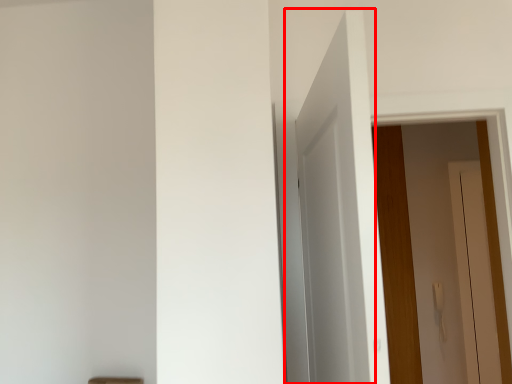
Question: Observing the image, what is the correct spatial positioning of door (annotated by the red box) in reference to door?

Choices:
 (A) left
 (B) right

Answer: (A)